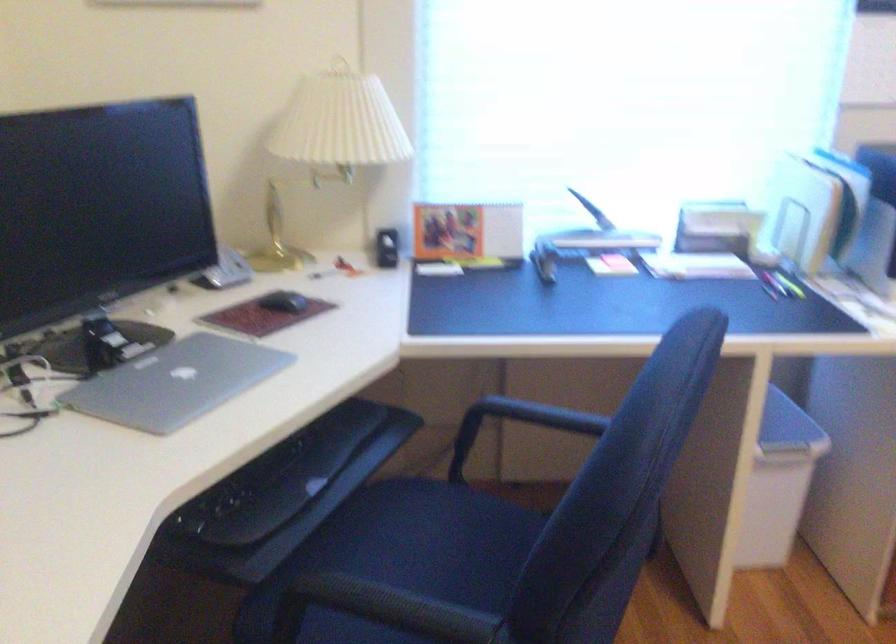
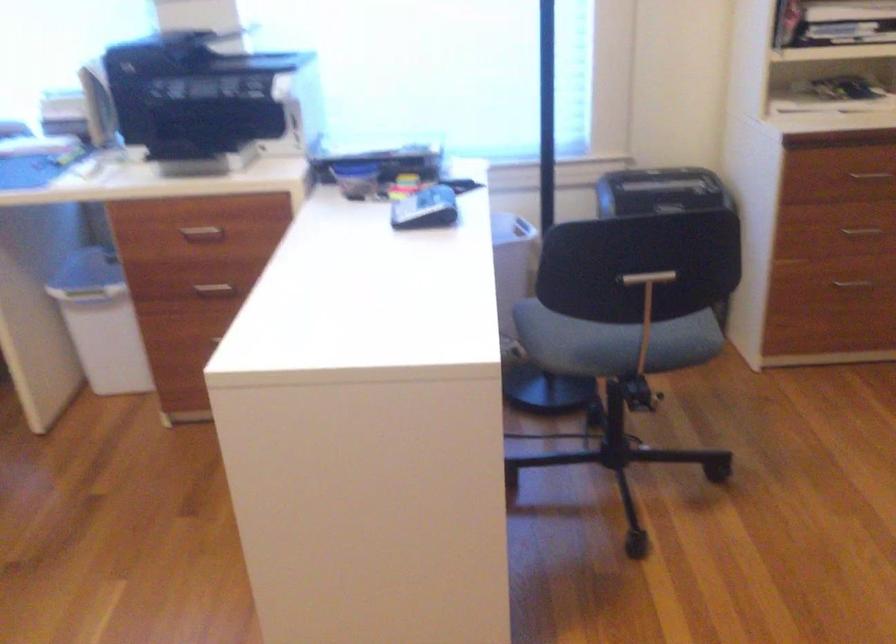
Question: In a continuous first-person perspective shot, in which direction is the camera moving?

Choices:
 (A) Left
 (B) Right
 (C) Forward
 (D) Backward

Answer: (B)